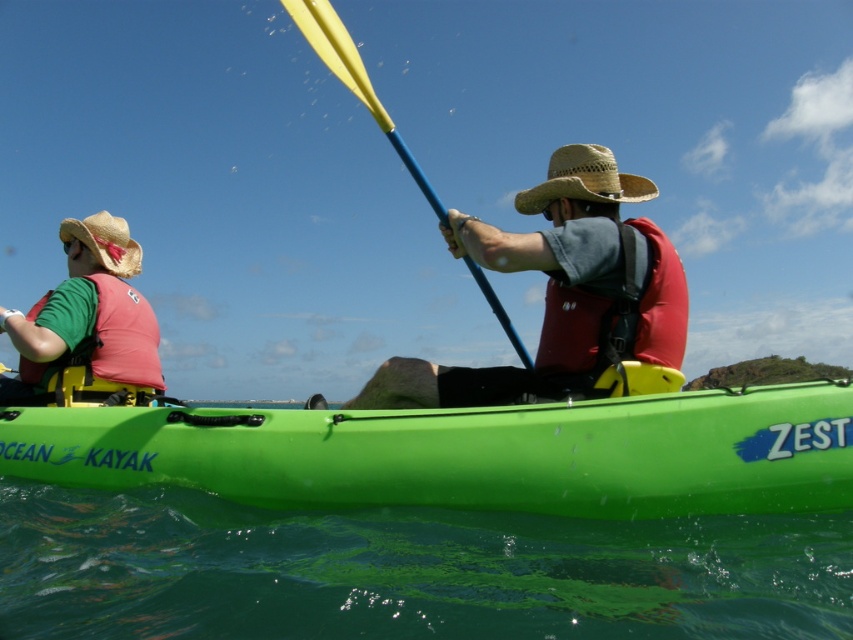
Question: From the image, what is the correct spatial relationship of matte pink life vest at left in relation to straw hat at left?

Choices:
 (A) left
 (B) right

Answer: (A)

Question: From the image, what is the correct spatial relationship of red matte life jacket at center in relation to straw woven hat at center?

Choices:
 (A) below
 (B) above

Answer: (A)

Question: Which of these objects is positioned farthest from the straw hat at left?

Choices:
 (A) yellowsmoothpaddle at center
 (B) matte pink life vest at left
 (C) straw woven hat at center
 (D) green plastic kayak at center

Answer: (C)

Question: Does matte red life vest at center appear on the right side of straw hat at left?

Choices:
 (A) no
 (B) yes

Answer: (B)

Question: Which of the following is the farthest from the observer?

Choices:
 (A) matte red life vest at center
 (B) straw woven hat at center
 (C) matte pink life vest at left
 (D) green plastic kayak at center

Answer: (C)

Question: Among these points, which one is farthest from the camera?

Choices:
 (A) (619, 193)
 (B) (129, 257)
 (C) (827, 468)
 (D) (317, 40)

Answer: (B)